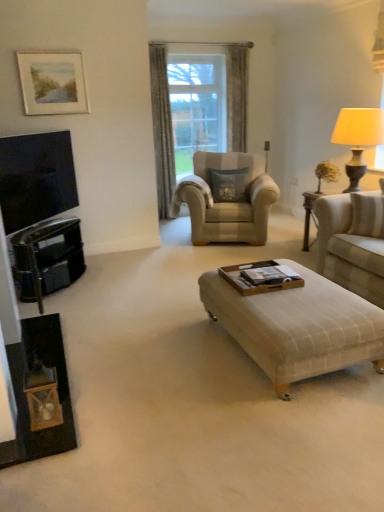
Where is `empty space that is ontop of matte white picture frame at upper left`? The width and height of the screenshot is (384, 512). empty space that is ontop of matte white picture frame at upper left is located at coordinates (48, 47).